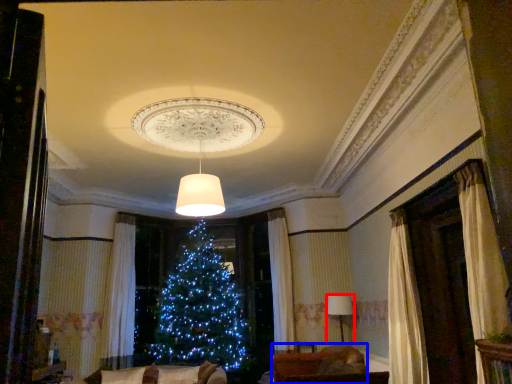
Question: Which point is further to the camera, lamp (highlighted by a red box) or furniture (highlighted by a blue box)?

Choices:
 (A) lamp
 (B) furniture

Answer: (A)